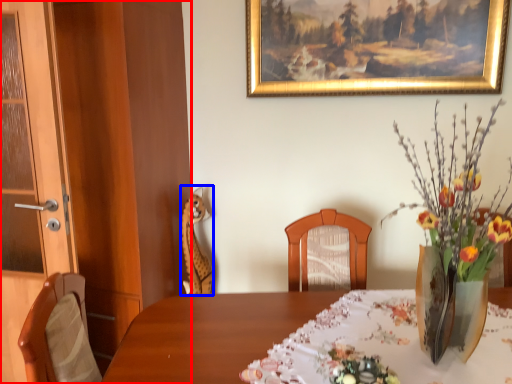
Question: Which of the following is the closest to the observer, dresser (highlighted by a red box) or animal (highlighted by a blue box)?

Choices:
 (A) dresser
 (B) animal

Answer: (A)